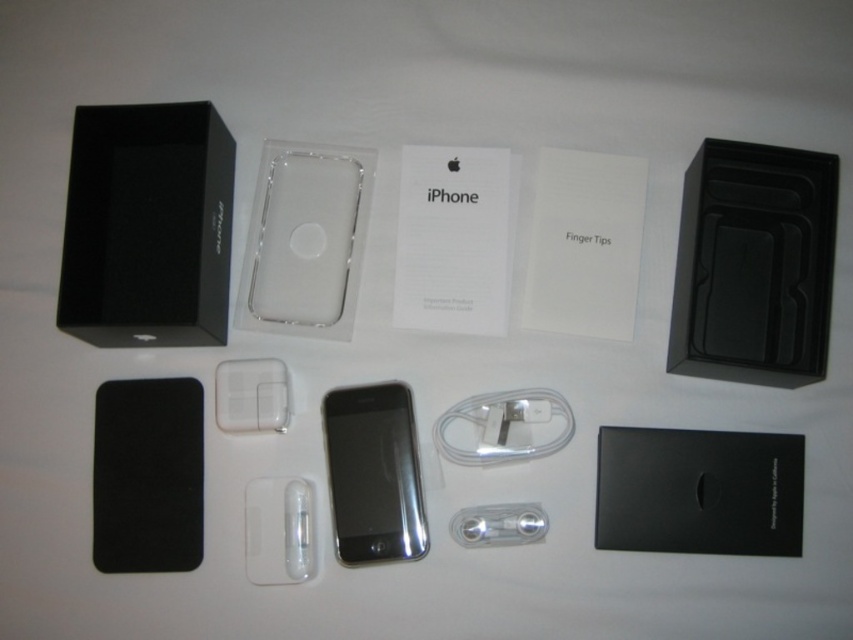
Which of these two, black matte speaker at upper right or clear plastic ipod at center, stands taller?

Standing taller between the two is black matte speaker at upper right.

I want to click on black matte speaker at upper right, so click(x=753, y=264).

Based on the photo, does black glossy speaker at upper left lie behind clear plastic ipod at center?

That is False.

Between point (155, 312) and point (267, 513), which one is positioned behind?

The point (155, 312) is behind.

Is point (106, 145) positioned before point (309, 545)?

No, (106, 145) is behind (309, 545).

The image size is (853, 640). Identify the location of black glossy speaker at upper left. (148, 227).

Is sleek black phone at center bigger than white glossy cable at center?

Correct, sleek black phone at center is larger in size than white glossy cable at center.

Between point (404, 536) and point (563, 440), which one is positioned behind?

Positioned behind is point (563, 440).

Between point (381, 492) and point (482, 448), which one is positioned behind?

The point (482, 448) is behind.

At what (x,y) coordinates should I click in order to perform the action: click on sleek black phone at center. Please return your answer as a coordinate pair (x, y). Image resolution: width=853 pixels, height=640 pixels. Looking at the image, I should click on (373, 474).